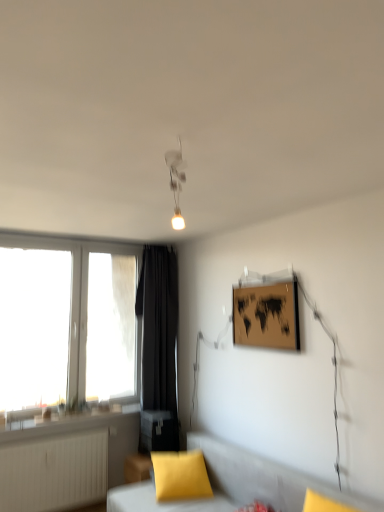
Question: Is white plastic window at left inside the boundaries of wooden matte picture frame at upper right, or outside?

Choices:
 (A) outside
 (B) inside

Answer: (A)

Question: In terms of height, does white plastic window at left look taller or shorter compared to wooden matte picture frame at upper right?

Choices:
 (A) short
 (B) tall

Answer: (B)

Question: Considering the real-world distances, which object is closest to the black fabric curtain at left?

Choices:
 (A) matte yellow pillow at lower center
 (B) matte white ceiling light at upper center
 (C) white plastic window at left
 (D) wooden matte picture frame at upper right
 (E) soft gray cushion at lower center

Answer: (C)

Question: Which is nearer to the soft gray cushion at lower center?

Choices:
 (A) black fabric curtain at left
 (B) wooden matte picture frame at upper right
 (C) matte white ceiling light at upper center
 (D) matte yellow pillow at lower center
 (E) white plastic window at left

Answer: (D)